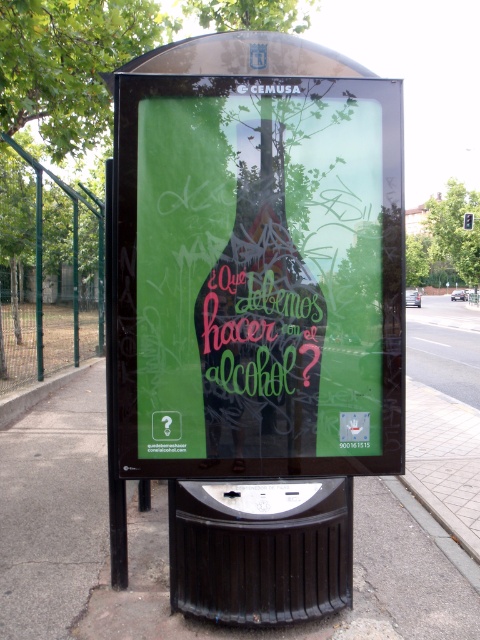
You are a pedestrian passing by the bus stop and want to read the information on the green matte poster at center and the neon green glass bottle at center. Which object is taller?

The green matte poster at center is much taller than the neon green glass bottle at center.